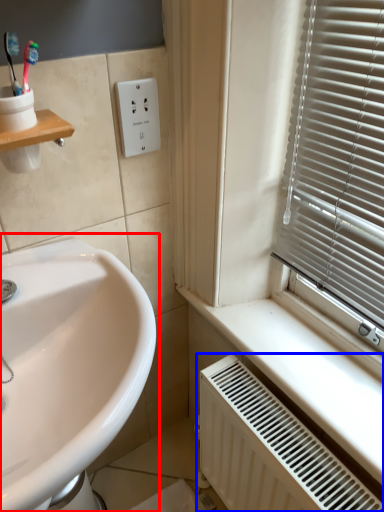
Question: Which point is closer to the camera, sink (highlighted by a red box) or radiator (highlighted by a blue box)?

Choices:
 (A) sink
 (B) radiator

Answer: (A)